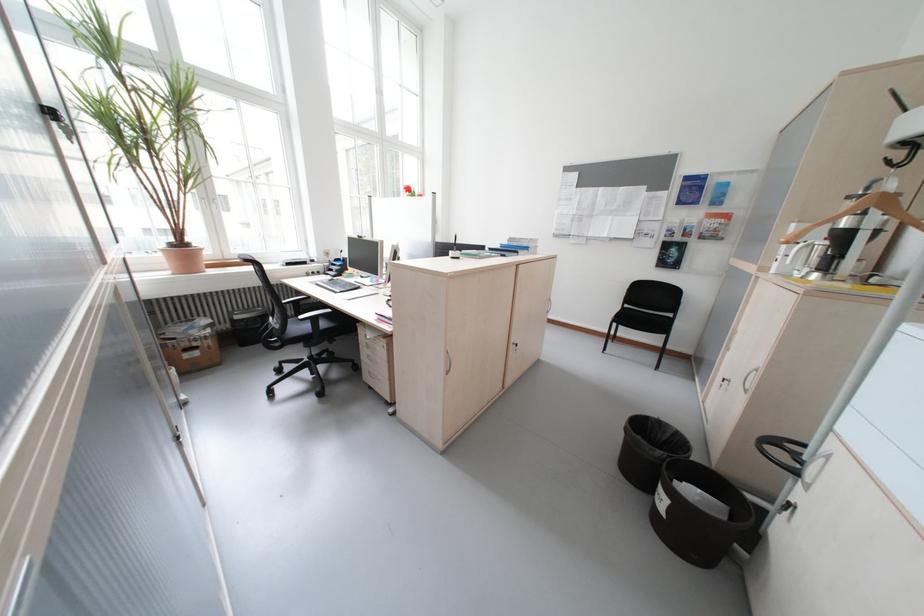
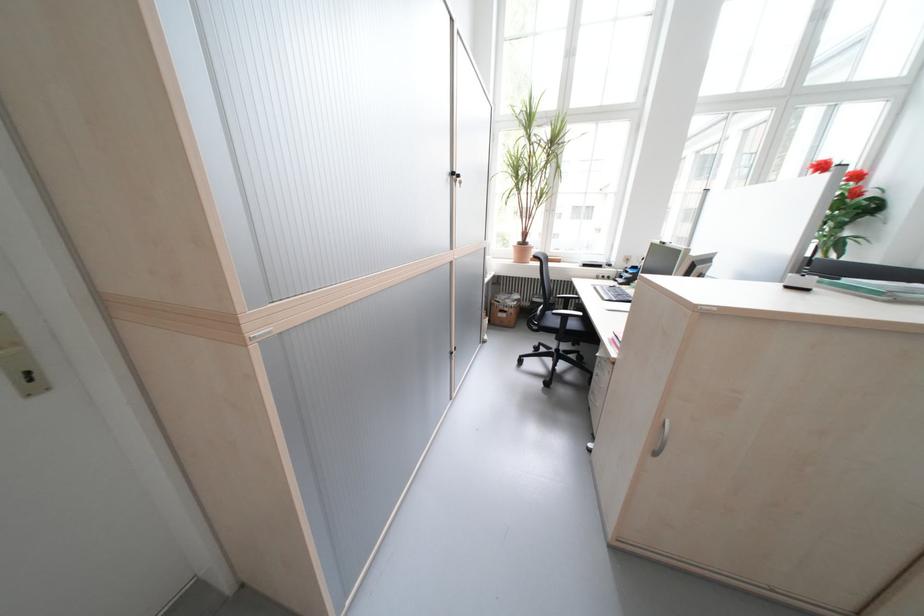
Where in the second image is the point corresponding to [332,272] from the first image?

(623, 278)